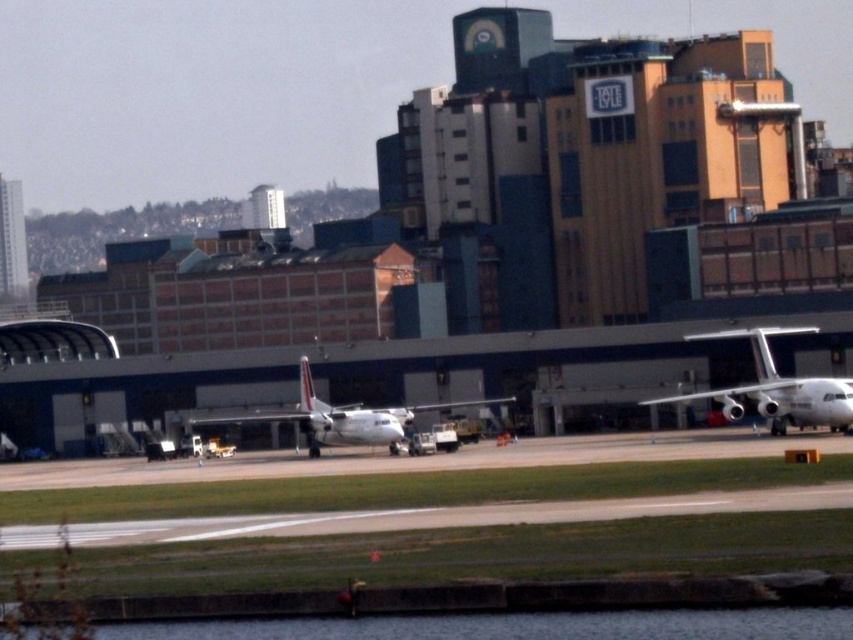
Does smooth asphalt runway at center come behind white matte airplane at center?

That is False.

Looking at this image, is smooth asphalt runway at center to the left of white matte airplane at center from the viewer's perspective?

Incorrect, smooth asphalt runway at center is not on the left side of white matte airplane at center.

Does point (177, 540) lie behind point (351, 408)?

No, (177, 540) is closer to viewer.

At what (x,y) coordinates should I click in order to perform the action: click on smooth asphalt runway at center. Please return your answer as a coordinate pair (x, y). Looking at the image, I should click on (456, 515).

In the scene shown: Who is positioned more to the right, smooth asphalt runway at center or white glossy airplane at right?

Positioned to the right is white glossy airplane at right.

Is smooth asphalt runway at center shorter than white glossy airplane at right?

Yes.

The width and height of the screenshot is (853, 640). Identify the location of smooth asphalt runway at center. (456, 515).

Is white glossy airplane at right to the right of white matte airplane at center from the viewer's perspective?

Indeed, white glossy airplane at right is positioned on the right side of white matte airplane at center.

In the scene shown: How much distance is there between white glossy airplane at right and white matte airplane at center?

They are 13.54 meters apart.

Describe the element at coordinates (776, 388) in the screenshot. Image resolution: width=853 pixels, height=640 pixels. I see `white glossy airplane at right` at that location.

What are the coordinates of `white glossy airplane at right` in the screenshot? It's located at coord(776,388).